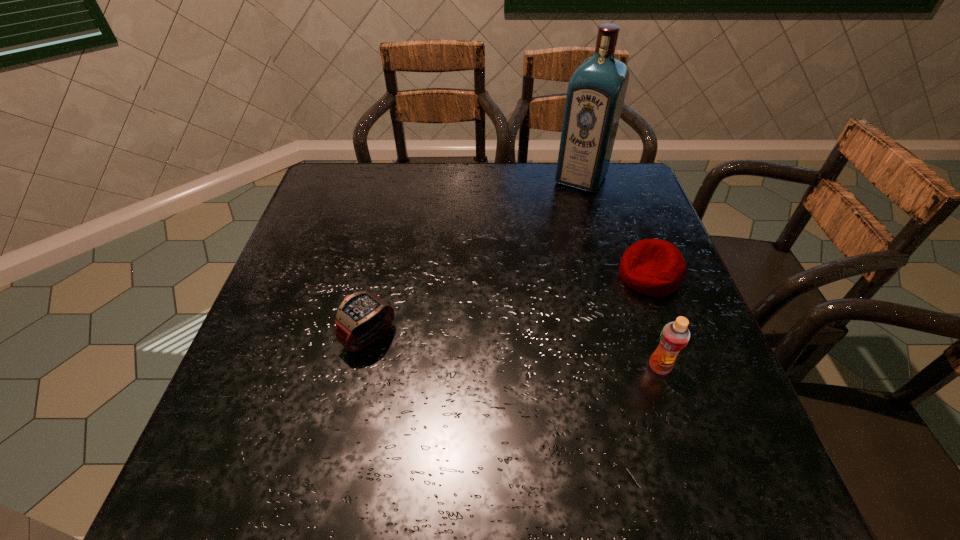
At what (x,y) coordinates should I click in order to perform the action: click on vacant space at the far edge of the desktop. Please return your answer as a coordinate pair (x, y). The width and height of the screenshot is (960, 540). Looking at the image, I should click on (466, 195).

This screenshot has width=960, height=540. In the image, there is a desktop. What are the coordinates of `vacant region at the near edge` in the screenshot? It's located at (408, 421).

Find the location of a particular element. The width and height of the screenshot is (960, 540). vacant space at the left edge of the desktop is located at coordinates (321, 273).

Locate an element on the screen. The image size is (960, 540). vacant space at the right edge of the desktop is located at coordinates (666, 380).

At what (x,y) coordinates should I click in order to perform the action: click on vacant region at the far left corner of the desktop. Please return your answer as a coordinate pair (x, y). Looking at the image, I should click on (326, 165).

Where is `free region at the far right corner`? This screenshot has height=540, width=960. free region at the far right corner is located at coordinates [648, 198].

Where is `free spot at the near right corner of the desktop`? free spot at the near right corner of the desktop is located at coordinates (741, 416).

Locate an element on the screen. The height and width of the screenshot is (540, 960). free spot between the liquor and the shortest object is located at coordinates (615, 227).

This screenshot has width=960, height=540. Identify the location of empty space between the leftmost object and the shortest object. (510, 306).

Where is `vacant area between the shortest object and the liquor`? This screenshot has width=960, height=540. vacant area between the shortest object and the liquor is located at coordinates (615, 227).